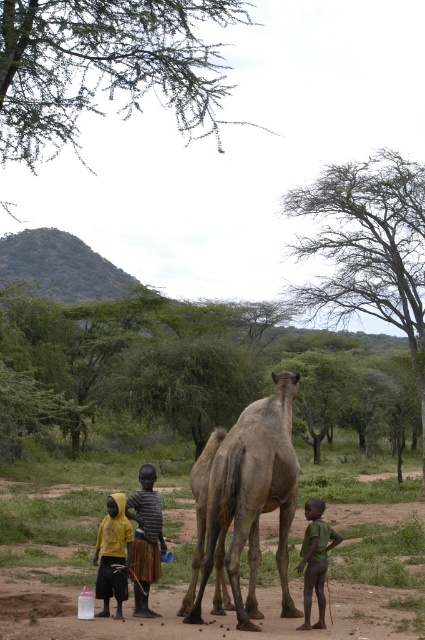
You are standing at the point labeled as point (178, 604) in the image. What is the terrain like at that location?

The terrain at point (178, 604) is a brown dirt field at lower center.

Looking at this image, you are planning to set up a small tent for shade in this rural scene. The tent requires a flat area larger than the brown textured camel at center. Can the brown dirt field at lower center accommodate the tent?

The brown dirt field at lower center is larger in size than the brown textured camel at center, so yes, it can accommodate the tent since it has enough space.